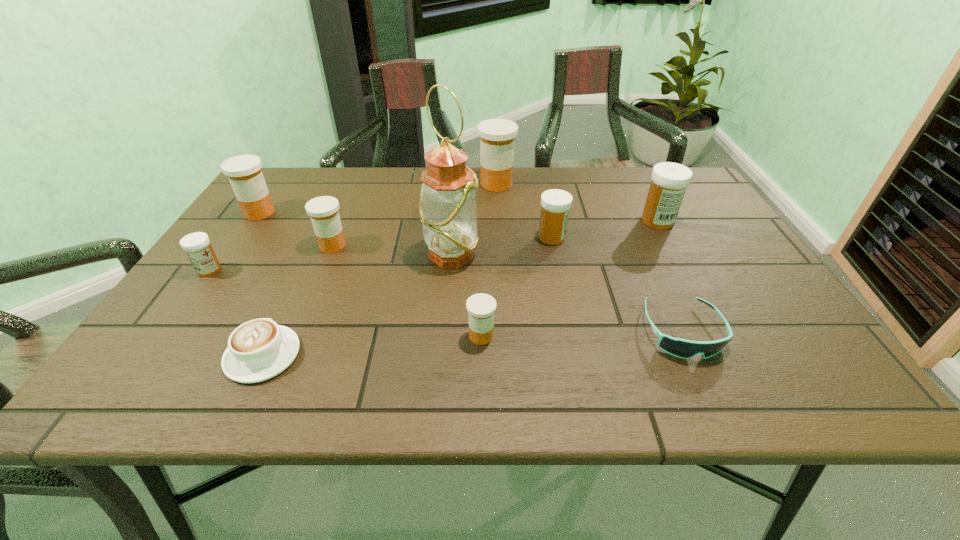
Find the location of `the second white medicine from left to right`. the second white medicine from left to right is located at coordinates (555, 204).

Find the location of a particular element. The height and width of the screenshot is (540, 960). the smallest white medicine is located at coordinates (197, 246).

Locate an element on the screen. The height and width of the screenshot is (540, 960). the second nearest medicine is located at coordinates (x=197, y=246).

Identify the location of the nearest orange medicine. The height and width of the screenshot is (540, 960). (481, 307).

The height and width of the screenshot is (540, 960). I want to click on the smallest orange medicine, so click(x=481, y=307).

Where is `cappuccino`? The width and height of the screenshot is (960, 540). cappuccino is located at coordinates (260, 349).

The image size is (960, 540). Identify the location of sunglasses. (682, 348).

I want to click on free region located 0.370m on the left of the oil lamp, so [x=272, y=255].

Where is `blank area located on the label of the ninth shortest object`? blank area located on the label of the ninth shortest object is located at coordinates (428, 184).

I want to click on vacant space located 0.200m on the label of the ninth shortest object, so click(x=412, y=184).